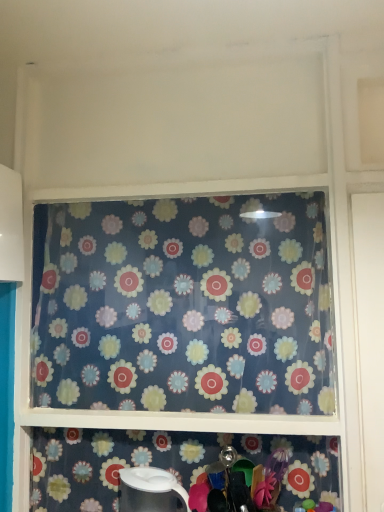
Describe the element at coordinates (150, 490) in the screenshot. The height and width of the screenshot is (512, 384). I see `white glossy kettle at lower center` at that location.

Identify the location of floral-patterned fabric at center. (183, 306).

Is white glossy pitcher at lower center at the left side of floral-patterned fabric at center?

Incorrect, white glossy pitcher at lower center is not on the left side of floral-patterned fabric at center.

From the image's perspective, is white glossy pitcher at lower center beneath floral-patterned fabric at center?

Correct, white glossy pitcher at lower center appears lower than floral-patterned fabric at center in the image.

Is white glossy pitcher at lower center in front of or behind floral-patterned fabric at center in the image?

white glossy pitcher at lower center is positioned closer to the viewer than floral-patterned fabric at center.

Is white glossy pitcher at lower center shorter than floral-patterned fabric at center?

Yes.

Considering the relative sizes of white glossy pitcher at lower center and white glossy kettle at lower center in the image provided, is white glossy pitcher at lower center smaller than white glossy kettle at lower center?

Actually, white glossy pitcher at lower center might be larger than white glossy kettle at lower center.

Is white glossy pitcher at lower center looking in the opposite direction of white glossy kettle at lower center?

Yes, white glossy pitcher at lower center is facing away from white glossy kettle at lower center.

Considering the sizes of objects white glossy pitcher at lower center and white glossy kettle at lower center in the image provided, who is taller, white glossy pitcher at lower center or white glossy kettle at lower center?

With more height is white glossy pitcher at lower center.

The width and height of the screenshot is (384, 512). Identify the location of shelf above the white glossy kettle at lower center (from the image's perspective). (176, 466).

Is floral-patterned fabric at center wider or thinner than white glossy kettle at lower center?

In the image, floral-patterned fabric at center appears to be more narrow than white glossy kettle at lower center.

Is floral-patterned fabric at center placed right next to white glossy kettle at lower center?

They are not placed beside each other.

From the image's perspective, is floral-patterned fabric at center on top of white glossy kettle at lower center?

Indeed, from the image's perspective, floral-patterned fabric at center is shown above white glossy kettle at lower center.

How many degrees apart are the facing directions of floral-patterned fabric at center and white glossy kettle at lower center?

The facing directions of floral-patterned fabric at center and white glossy kettle at lower center are 1.86 degrees apart.

How many degrees apart are the facing directions of white glossy kettle at lower center and floral-patterned fabric at center?

The angular difference between white glossy kettle at lower center and floral-patterned fabric at center is 1.86 degrees.

Which of these two, white glossy kettle at lower center or floral-patterned fabric at center, is bigger?

floral-patterned fabric at center.

Is white glossy kettle at lower center thinner than floral-patterned fabric at center?

In fact, white glossy kettle at lower center might be wider than floral-patterned fabric at center.

Considering their positions, is white glossy kettle at lower center located in front of or behind floral-patterned fabric at center?

white glossy kettle at lower center is in front of floral-patterned fabric at center.

Which of these two, white glossy kettle at lower center or white glossy pitcher at lower center, stands taller?

white glossy pitcher at lower center.

In the scene shown: Considering the relative sizes of white glossy kettle at lower center and white glossy pitcher at lower center in the image provided, is white glossy kettle at lower center bigger than white glossy pitcher at lower center?

Incorrect, white glossy kettle at lower center is not larger than white glossy pitcher at lower center.

From a real-world perspective, which is physically above, white glossy kettle at lower center or white glossy pitcher at lower center?

In real-world perspective, white glossy pitcher at lower center is above.

Which object is closer to the camera taking this photo, white glossy kettle at lower center or white glossy pitcher at lower center?

white glossy kettle at lower center is closer to the camera.

Can you confirm if floral-patterned fabric at center is shorter than white glossy pitcher at lower center?

No, floral-patterned fabric at center is not shorter than white glossy pitcher at lower center.

Are floral-patterned fabric at center and white glossy pitcher at lower center beside each other?

No, floral-patterned fabric at center is not touching white glossy pitcher at lower center.

The height and width of the screenshot is (512, 384). I want to click on shelf in front of the floral-patterned fabric at center, so click(176, 466).

From a real-world perspective, which is physically below, floral-patterned fabric at center or white glossy pitcher at lower center?

white glossy pitcher at lower center, from a real-world perspective.

The height and width of the screenshot is (512, 384). I want to click on shelf that appears in front of the floral-patterned fabric at center, so click(x=176, y=466).

Locate an element on the screen. appliance that is under the white glossy pitcher at lower center (from a real-world perspective) is located at coordinates (150, 490).

When comparing their distances from white glossy pitcher at lower center, does floral-patterned fabric at center or white glossy kettle at lower center seem further?

Based on the image, floral-patterned fabric at center appears to be further to white glossy pitcher at lower center.

Estimate the real-world distances between objects in this image. Which object is closer to floral-patterned fabric at center, white glossy pitcher at lower center or white glossy kettle at lower center?

white glossy pitcher at lower center is closer to floral-patterned fabric at center.

From the image, which object appears to be farther from white glossy kettle at lower center, floral-patterned fabric at center or white glossy pitcher at lower center?

Among the two, floral-patterned fabric at center is located further to white glossy kettle at lower center.

From the image, which object appears to be farther from floral-patterned fabric at center, white glossy kettle at lower center or white glossy pitcher at lower center?

The object further to floral-patterned fabric at center is white glossy kettle at lower center.

Looking at the image, which one is located closer to white glossy kettle at lower center, white glossy pitcher at lower center or floral-patterned fabric at center?

The object closer to white glossy kettle at lower center is white glossy pitcher at lower center.

Considering their positions, is white glossy kettle at lower center positioned further to white glossy pitcher at lower center than floral-patterned fabric at center?

floral-patterned fabric at center is further to white glossy pitcher at lower center.

This screenshot has height=512, width=384. Identify the location of shelf between floral-patterned fabric at center and white glossy kettle at lower center from top to bottom. (176, 466).